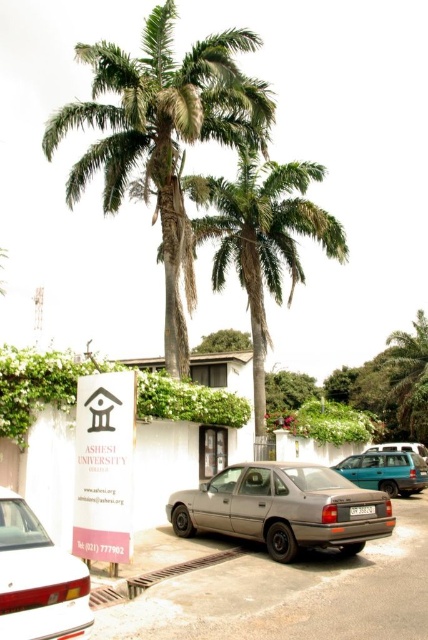
Question: Is the position of green leafy palm trees at upper center less distant than that of white plastic license plate at center?

Choices:
 (A) no
 (B) yes

Answer: (A)

Question: Which of the following is the closest to the observer?

Choices:
 (A) green leafy palm trees at upper center
 (B) metallic gray car at center

Answer: (B)

Question: Considering the relative positions of metallic gray car at center and satin silver sedan at center in the image provided, where is metallic gray car at center located with respect to satin silver sedan at center?

Choices:
 (A) below
 (B) above

Answer: (A)

Question: Which of the following is the closest to the observer?

Choices:
 (A) white plastic license plate at center
 (B) satin silver suv at center

Answer: (A)

Question: Which object is closer to the camera taking this photo?

Choices:
 (A) metallic gray car at center
 (B) green leafy palm trees at upper center
 (C) white matte car at lower left
 (D) white plastic license plate at center

Answer: (C)

Question: Does white matte car at lower left appear on the left side of teal matte station wagon at center?

Choices:
 (A) yes
 (B) no

Answer: (A)